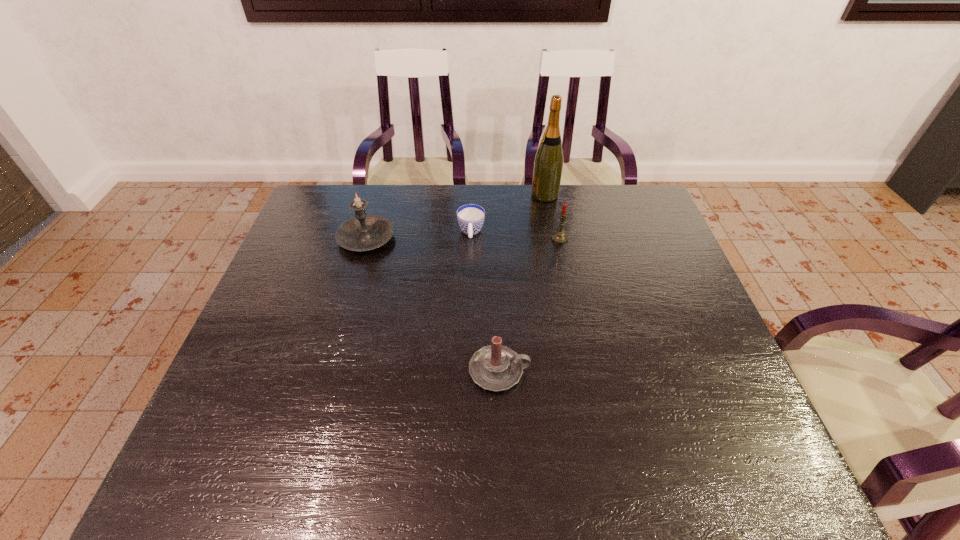
This screenshot has width=960, height=540. In order to click on free space that satisfies the following two spatial constraints: 1. on the front side of the rightmost candle; 2. on the side of the nearest object with the handle loop in this screenshot , I will do `click(586, 371)`.

Where is `vacant space that satisfies the following two spatial constraints: 1. on the front-facing side of the tallest object; 2. on the front side of the leftmost object`? This screenshot has height=540, width=960. vacant space that satisfies the following two spatial constraints: 1. on the front-facing side of the tallest object; 2. on the front side of the leftmost object is located at coordinates (553, 238).

Locate an element on the screen. The image size is (960, 540). free location that satisfies the following two spatial constraints: 1. on the front-facing side of the tallest object; 2. on the back side of the rightmost candle is located at coordinates point(553,239).

The height and width of the screenshot is (540, 960). Identify the location of free location that satisfies the following two spatial constraints: 1. on the front-facing side of the farthest object; 2. on the left side of the rightmost candle. (553, 239).